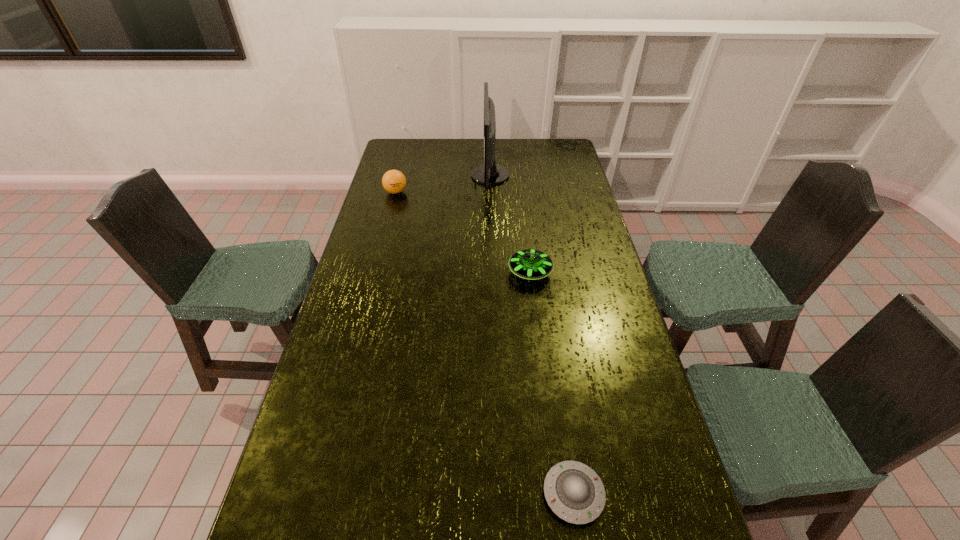
This screenshot has height=540, width=960. I want to click on the second closest object to the second tallest object, so click(x=529, y=264).

Identify the location of vacant space that satisfies the following two spatial constraints: 1. on the side with brand of the third farthest object; 2. on the right side of the ping-pong ball. (374, 273).

This screenshot has height=540, width=960. I want to click on vacant area that satisfies the following two spatial constraints: 1. on the side with brand of the farther saucer; 2. on the right side of the leftmost object, so (x=374, y=273).

Locate an element on the screen. This screenshot has width=960, height=540. vacant space that satisfies the following two spatial constraints: 1. on the back side of the nearest object; 2. on the screen side of the tallest object is located at coordinates (526, 176).

At what (x,y) coordinates should I click in order to perform the action: click on free point that satisfies the following two spatial constraints: 1. on the screen side of the monitor; 2. on the side with brand of the second tallest object. Please return your answer as a coordinate pair (x, y). Looking at the image, I should click on (491, 192).

This screenshot has height=540, width=960. Find the location of `free space that satisfies the following two spatial constraints: 1. on the side with brand of the taller saucer; 2. on the left side of the second tallest object`. free space that satisfies the following two spatial constraints: 1. on the side with brand of the taller saucer; 2. on the left side of the second tallest object is located at coordinates (374, 273).

The height and width of the screenshot is (540, 960). In order to click on free spot that satisfies the following two spatial constraints: 1. on the side with brand of the shorter saucer; 2. on the left side of the ping-pong ball in this screenshot , I will do `click(318, 494)`.

Find the location of `vacant point that satisfies the following two spatial constraints: 1. on the screen side of the monitor; 2. on the back side of the shorter saucer`. vacant point that satisfies the following two spatial constraints: 1. on the screen side of the monitor; 2. on the back side of the shorter saucer is located at coordinates (500, 494).

The image size is (960, 540). Find the location of `free region that satisfies the following two spatial constraints: 1. on the side with brand of the nearer saucer; 2. on the left side of the leftmost object`. free region that satisfies the following two spatial constraints: 1. on the side with brand of the nearer saucer; 2. on the left side of the leftmost object is located at coordinates (318, 494).

Locate an element on the screen. The image size is (960, 540). vacant space that satisfies the following two spatial constraints: 1. on the screen side of the monitor; 2. on the back side of the shorter saucer is located at coordinates (500, 494).